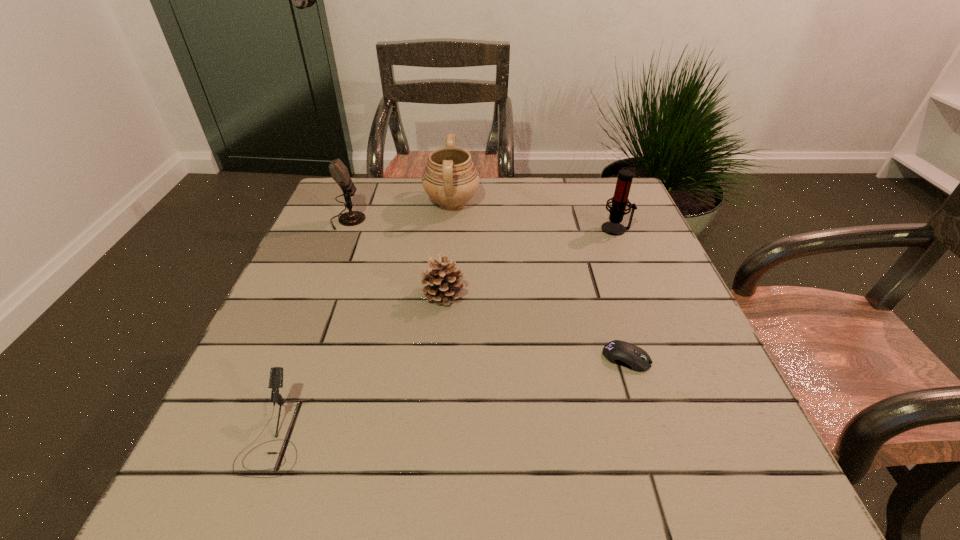
Where is `free space located 0.080m on the front of the second nearest object`? The height and width of the screenshot is (540, 960). free space located 0.080m on the front of the second nearest object is located at coordinates pyautogui.click(x=642, y=410).

You are a GUI agent. You are given a task and a screenshot of the screen. Output one action in this format:
    pyautogui.click(x=<x>, y=<y>)
    Task: Click on the urn present at the far edge
    
    Given the screenshot: What is the action you would take?
    pyautogui.click(x=450, y=178)

You are a GUI agent. You are given a task and a screenshot of the screen. Output one action in this format:
    pyautogui.click(x=<x>, y=<y>)
    Task: Click on the microphone that is at the far edge
    The height and width of the screenshot is (540, 960).
    Given the screenshot: What is the action you would take?
    pyautogui.click(x=339, y=172)

Where is `object present at the near edge`? The image size is (960, 540). object present at the near edge is located at coordinates (276, 373).

At what (x,y) coordinates should I click in order to perform the action: click on microphone that is at the right edge. Please return your answer as a coordinate pair (x, y). The width and height of the screenshot is (960, 540). Looking at the image, I should click on (620, 200).

Image resolution: width=960 pixels, height=540 pixels. Find the location of `computer equipment located at the right edge`. computer equipment located at the right edge is located at coordinates (622, 353).

The height and width of the screenshot is (540, 960). I want to click on object present at the far left corner, so click(339, 172).

The image size is (960, 540). Identify the location of object that is positioned at the near left corner. (276, 373).

What are the coordinates of `vacant space at the far edge` in the screenshot? It's located at (542, 212).

In the image, there is a desktop. What are the coordinates of `free space at the near edge` in the screenshot? It's located at (619, 490).